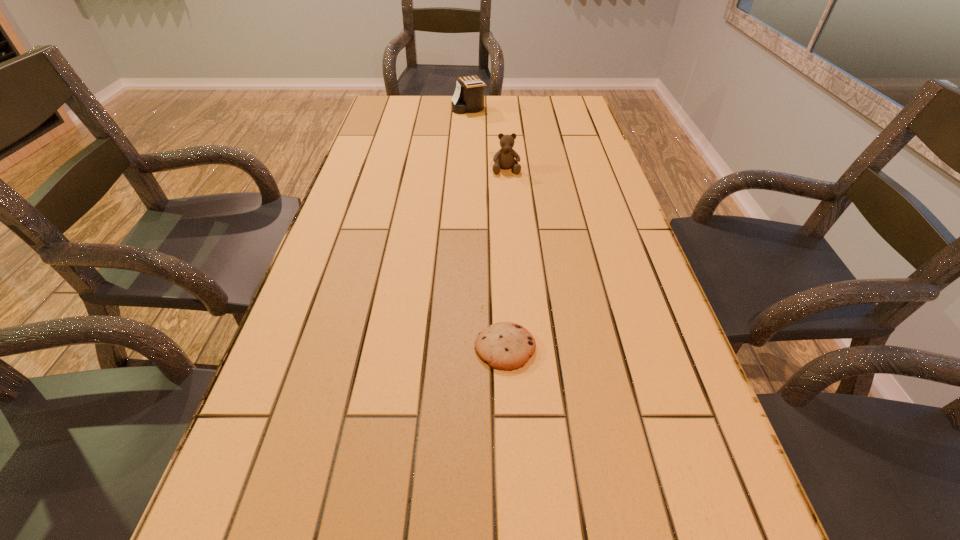
Locate an element on the screen. The image size is (960, 540). the second nearest object is located at coordinates (504, 158).

Identify the location of calculator. The width and height of the screenshot is (960, 540). (469, 95).

Locate an element on the screen. the shortest object is located at coordinates (508, 346).

Locate an element on the screen. The height and width of the screenshot is (540, 960). cookie is located at coordinates (508, 346).

What are the coordinates of `vacant space situated 0.300m on the front-facing side of the second nearest object` in the screenshot? It's located at [x=512, y=239].

Identify the location of free space located on the left of the calculator. (394, 108).

Where is `vacant space located 0.280m on the right of the nearest object`? The width and height of the screenshot is (960, 540). vacant space located 0.280m on the right of the nearest object is located at coordinates (679, 348).

At what (x,y) coordinates should I click in order to perform the action: click on object at the far edge. Please return your answer as a coordinate pair (x, y). Looking at the image, I should click on (469, 95).

Locate an element on the screen. The image size is (960, 540). free space at the far edge of the desktop is located at coordinates (420, 120).

The image size is (960, 540). In the image, there is a desktop. Identify the location of free space at the left edge. (396, 139).